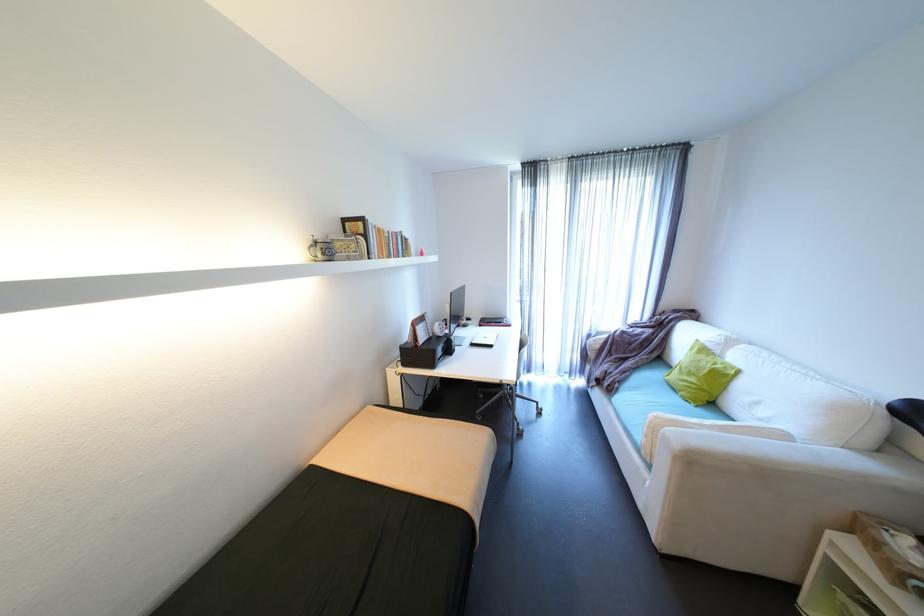
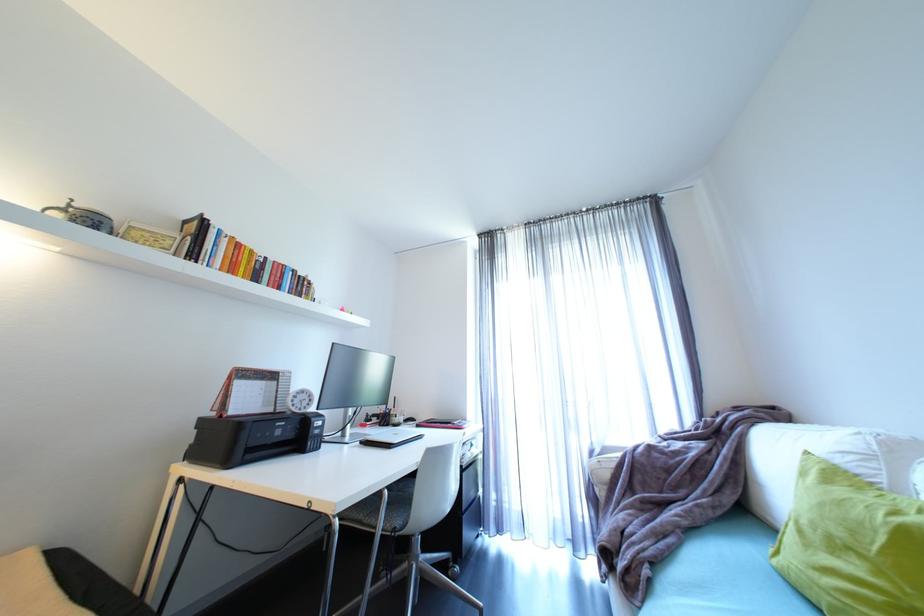
In the second image, find the point that corresponds to (x=448, y=330) in the first image.

(312, 402)